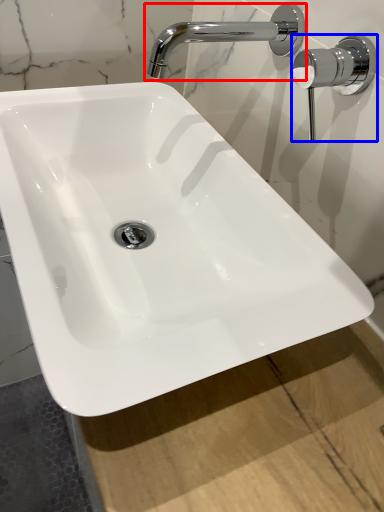
Question: Which object is closer to the camera taking this photo, tap (highlighted by a red box) or door handle (highlighted by a blue box)?

Choices:
 (A) tap
 (B) door handle

Answer: (B)